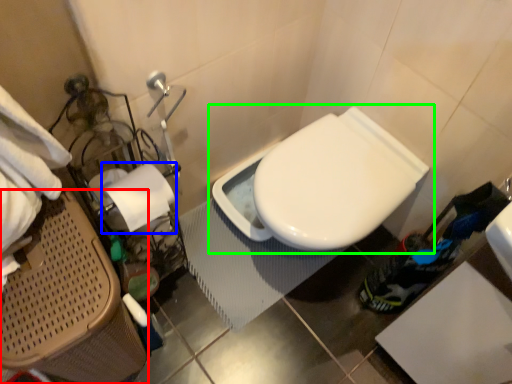
Question: Based on their relative distances, which object is farther from laundry basket (highlighted by a red box)? Choose from toilet paper (highlighted by a blue box) and toilet (highlighted by a green box).

Choices:
 (A) toilet paper
 (B) toilet

Answer: (B)